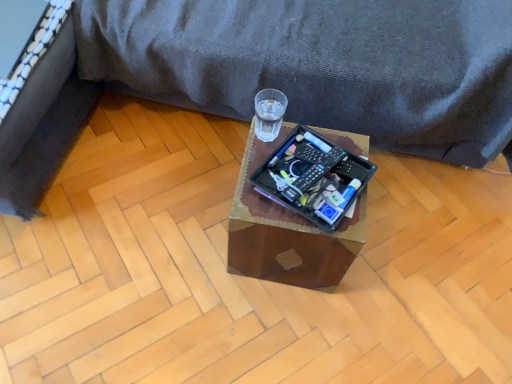
I want to click on vacant area to the left of wooden tray at center, so click(x=189, y=230).